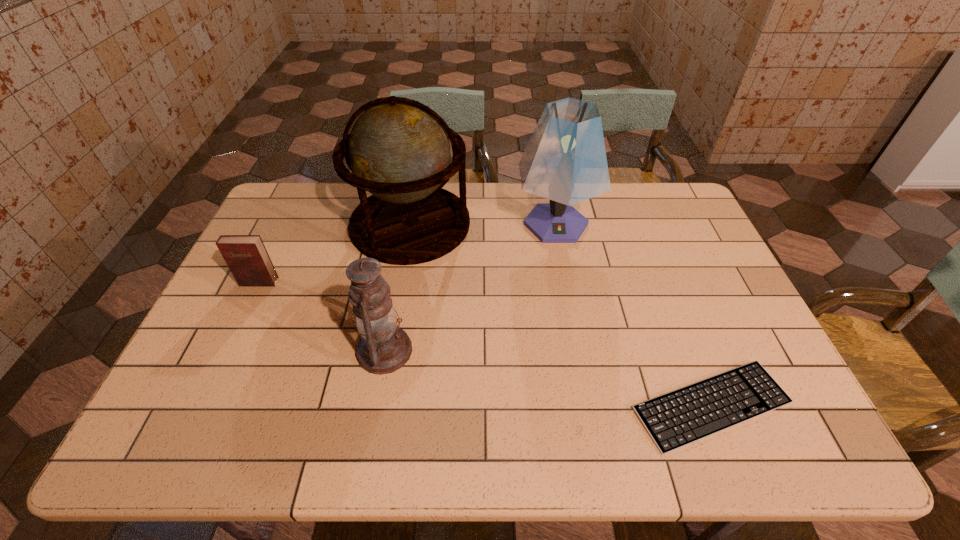
Find the location of a particular element. vacant area that satisfies the following two spatial constraints: 1. on the front cover of the third tallest object; 2. on the right side of the fourth tallest object is located at coordinates (227, 350).

In order to click on vacant space that satisfies the following two spatial constraints: 1. on the front cover of the diary; 2. on the right side of the third tallest object in this screenshot , I will do `click(227, 350)`.

Find the location of a particular element. vacant region that satisfies the following two spatial constraints: 1. on the front-facing side of the globe; 2. on the front cover of the second shortest object is located at coordinates (400, 282).